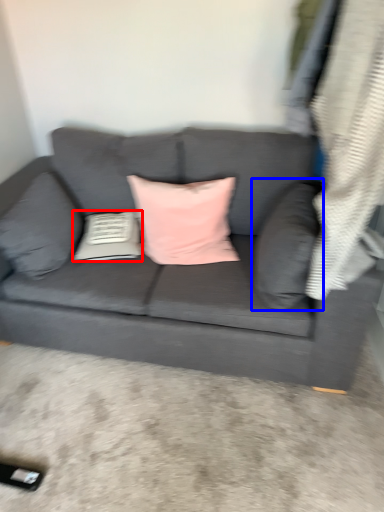
Question: Which object appears closest to the camera in this image, pillow (highlighted by a red box) or pillow (highlighted by a blue box)?

Choices:
 (A) pillow
 (B) pillow

Answer: (B)